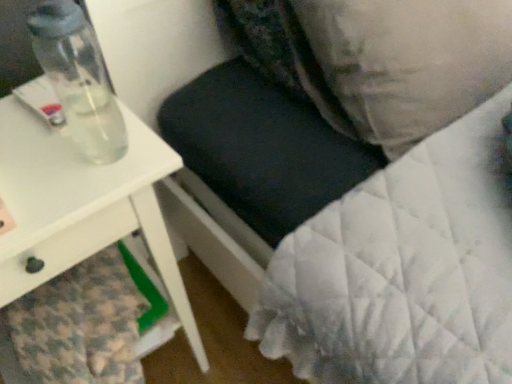
This screenshot has width=512, height=384. In order to click on vacant area situated to the left side of clear glass bottle at left in this screenshot , I will do `click(37, 155)`.